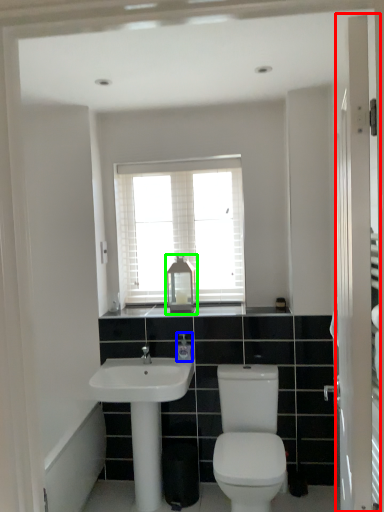
Question: Considering the real-world distances, which object is farthest from screen door (highlighted by a red box)? toiletry (highlighted by a blue box) or medicine cabinet (highlighted by a green box)?

Choices:
 (A) toiletry
 (B) medicine cabinet

Answer: (B)